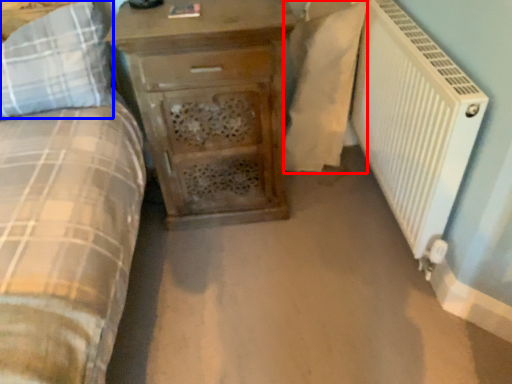
Question: Which object appears closest to the camera in this image, sheet (highlighted by a red box) or pillow (highlighted by a blue box)?

Choices:
 (A) sheet
 (B) pillow

Answer: (B)